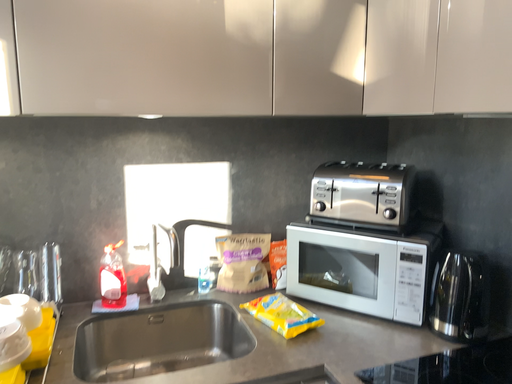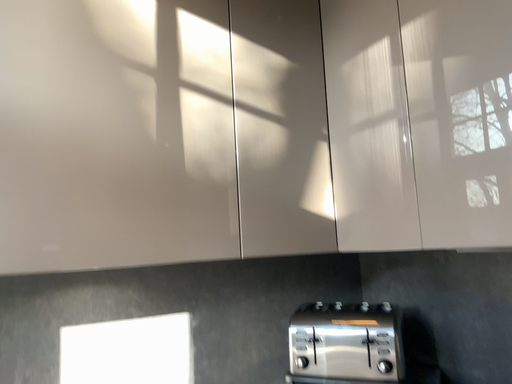
Question: Which way did the camera rotate in the video?

Choices:
 (A) rotated downward
 (B) rotated upward

Answer: (B)